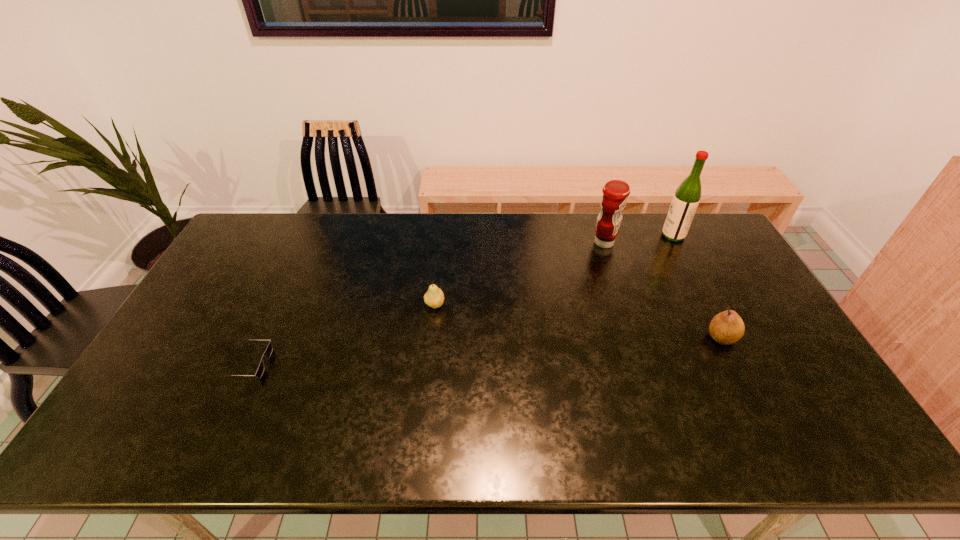
Locate an element on the screen. the tallest object is located at coordinates (685, 201).

You are a GUI agent. You are given a task and a screenshot of the screen. Output one action in this format:
    pyautogui.click(x=<x>, y=<y>)
    Task: Click on the condiment
    This screenshot has height=540, width=960.
    Given the screenshot: What is the action you would take?
    pyautogui.click(x=615, y=192)

Image resolution: width=960 pixels, height=540 pixels. Find the location of `the fourth shortest object`. the fourth shortest object is located at coordinates (615, 192).

Locate an element on the screen. The width and height of the screenshot is (960, 540). the nearer pear is located at coordinates (727, 327).

The height and width of the screenshot is (540, 960). Find the location of `the taller pear`. the taller pear is located at coordinates (727, 327).

The width and height of the screenshot is (960, 540). I want to click on the shorter pear, so click(x=434, y=297).

Locate an element on the screen. The height and width of the screenshot is (540, 960). the third farthest object is located at coordinates (434, 297).

You are a GUI agent. You are given a task and a screenshot of the screen. Output one action in this format:
    pyautogui.click(x=<x>, y=<y>)
    Task: Click on the leftmost object
    Image resolution: width=960 pixels, height=540 pixels.
    Given the screenshot: What is the action you would take?
    pyautogui.click(x=268, y=352)

The image size is (960, 540). What are the coordinates of `sunglasses` in the screenshot? It's located at (268, 352).

In order to click on free location located 0.140m on the label of the tallest object in this screenshot , I will do `click(623, 235)`.